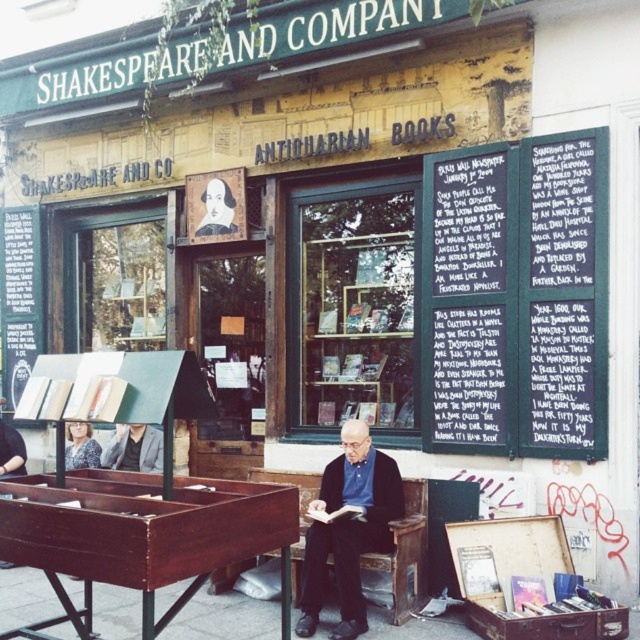
Describe the element at coordinates (516, 298) in the screenshot. The width and height of the screenshot is (640, 640). I see `black chalkboard at upper center` at that location.

Is black chalkboard at upper center thinner than dark blue shirt at center?

In fact, black chalkboard at upper center might be wider than dark blue shirt at center.

Is point (486, 257) closer to viewer compared to point (314, 589)?

No, (486, 257) is further to viewer.

Locate an element on the screen. This screenshot has height=640, width=640. black chalkboard at upper center is located at coordinates (516, 298).